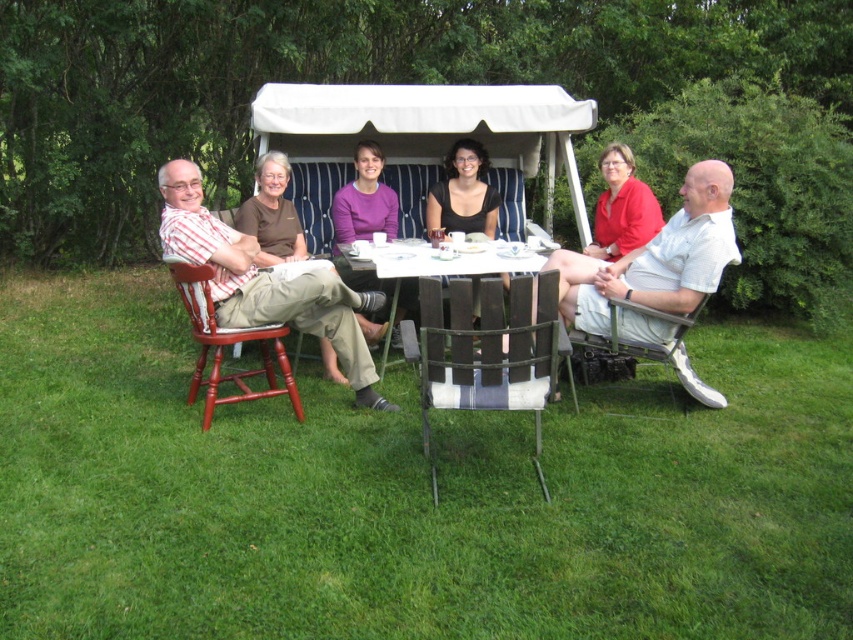
You are organizing a photo shoot and need to place a camera stand between the purple matte sweater at center and the matte brown shirt at center. Given that the camera stand requires 1 meter of space, can the stand fit between them based on their widths?

The purple matte sweater at center is wider than the matte brown shirt at center. However, the exact width difference isn not specified, so we cannot determine if the 1 meter space requirement is met. Additional measurements are needed.

In the scene described, there is a white wood table at center and a black matte shirt at center. From the perspective of someone facing the image, which object is positioned to the left?

The white wood table at center is to the left of the black matte shirt at center.